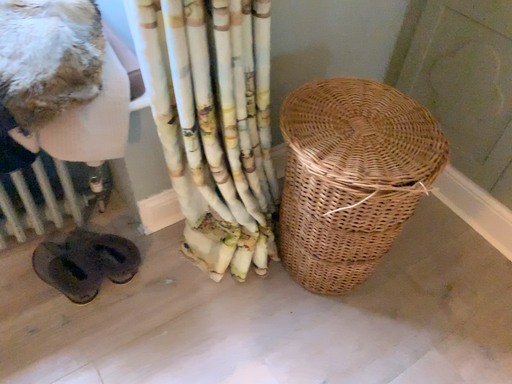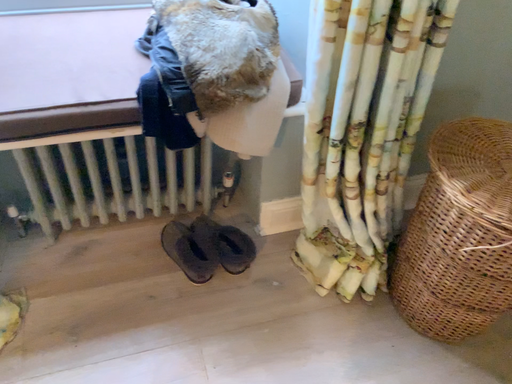
Question: Which way did the camera rotate in the video?

Choices:
 (A) rotated left
 (B) rotated right

Answer: (A)